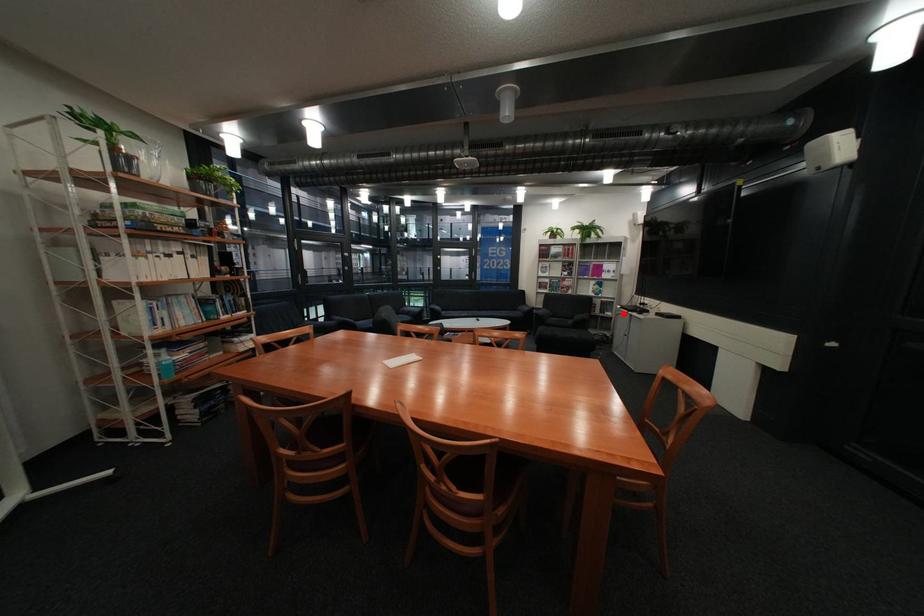
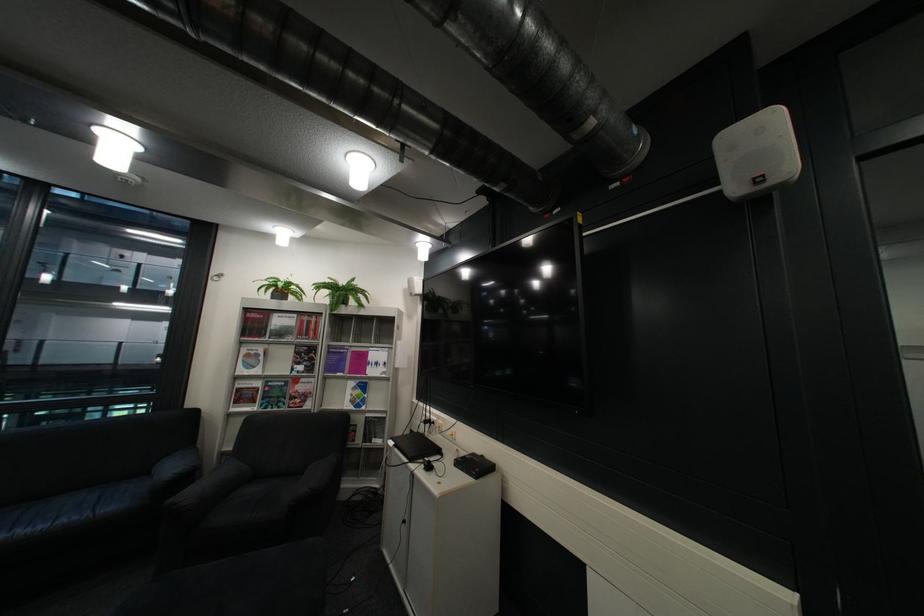
Where in the second image is the point corresponding to the highlighted location from the first image?

(393, 442)